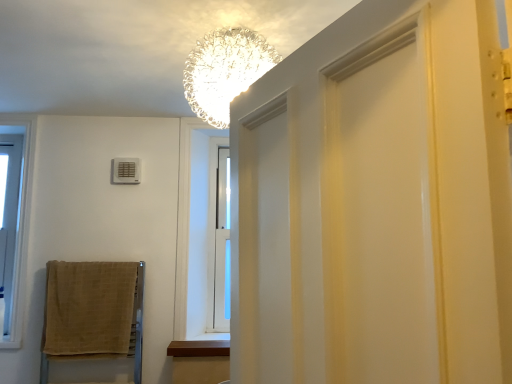
Question: Is beige woven towel at lower left next to brown wood at lower center and touching it?

Choices:
 (A) no
 (B) yes

Answer: (A)

Question: Does beige woven towel at lower left have a lesser width compared to brown wood at lower center?

Choices:
 (A) yes
 (B) no

Answer: (A)

Question: Is beige woven towel at lower left to the right of brown wood at lower center from the viewer's perspective?

Choices:
 (A) yes
 (B) no

Answer: (B)

Question: Considering the relative sizes of beige woven towel at lower left and brown wood at lower center in the image provided, is beige woven towel at lower left shorter than brown wood at lower center?

Choices:
 (A) no
 (B) yes

Answer: (A)

Question: Is beige woven towel at lower left bigger than brown wood at lower center?

Choices:
 (A) yes
 (B) no

Answer: (A)

Question: Is clear glass chandelier at upper center bigger or smaller than beige woven towel at lower left?

Choices:
 (A) big
 (B) small

Answer: (A)

Question: In the image, is clear glass chandelier at upper center on the left side or the right side of beige woven towel at lower left?

Choices:
 (A) right
 (B) left

Answer: (A)

Question: Is clear glass chandelier at upper center taller or shorter than beige woven towel at lower left?

Choices:
 (A) tall
 (B) short

Answer: (B)

Question: From the image's perspective, is clear glass chandelier at upper center positioned above or below beige woven towel at lower left?

Choices:
 (A) above
 (B) below

Answer: (A)

Question: Based on their positions, is clear glass window at left located to the left or right of clear glass chandelier at upper center?

Choices:
 (A) left
 (B) right

Answer: (A)

Question: Considering the positions of point (12, 152) and point (247, 67), is point (12, 152) closer or farther from the camera than point (247, 67)?

Choices:
 (A) closer
 (B) farther

Answer: (B)

Question: From the image's perspective, is clear glass window at left located above or below clear glass chandelier at upper center?

Choices:
 (A) below
 (B) above

Answer: (A)

Question: Based on their sizes in the image, would you say clear glass window at left is bigger or smaller than clear glass chandelier at upper center?

Choices:
 (A) small
 (B) big

Answer: (A)

Question: Relative to clear glass window at left, is beige woven towel at lower left in front or behind?

Choices:
 (A) behind
 (B) front

Answer: (B)

Question: From a real-world perspective, relative to clear glass window at left, is beige woven towel at lower left vertically above or below?

Choices:
 (A) above
 (B) below

Answer: (B)